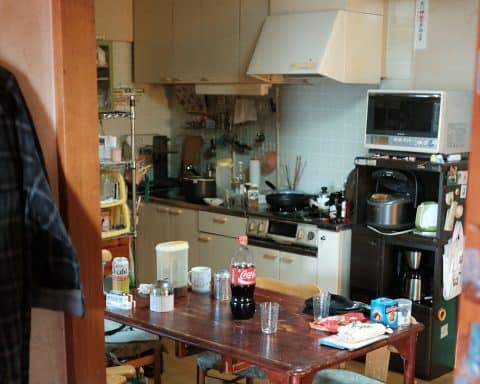
Locate an element on the screen. The height and width of the screenshot is (384, 480). wood border is located at coordinates (78, 202).